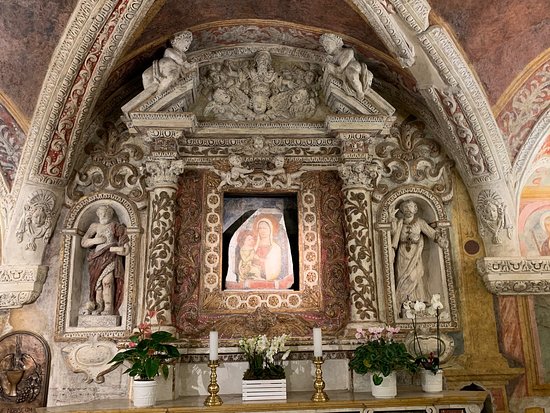
Locate an element on the screen. The height and width of the screenshot is (413, 550). golden candlestick holders is located at coordinates (210, 392), (317, 385).